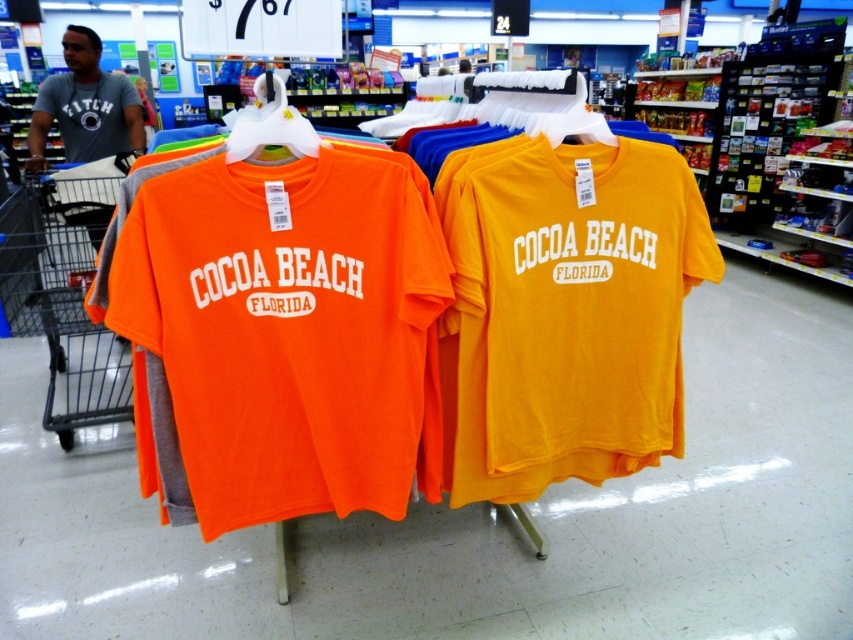
You are standing in the retail store and want to take a photo of the two points in the scene. Which point, point [608,436] or point [120,154], will appear larger in your camera view?

Point [608,436] will appear larger in the camera view because it is closer to the camera than point [120,154].